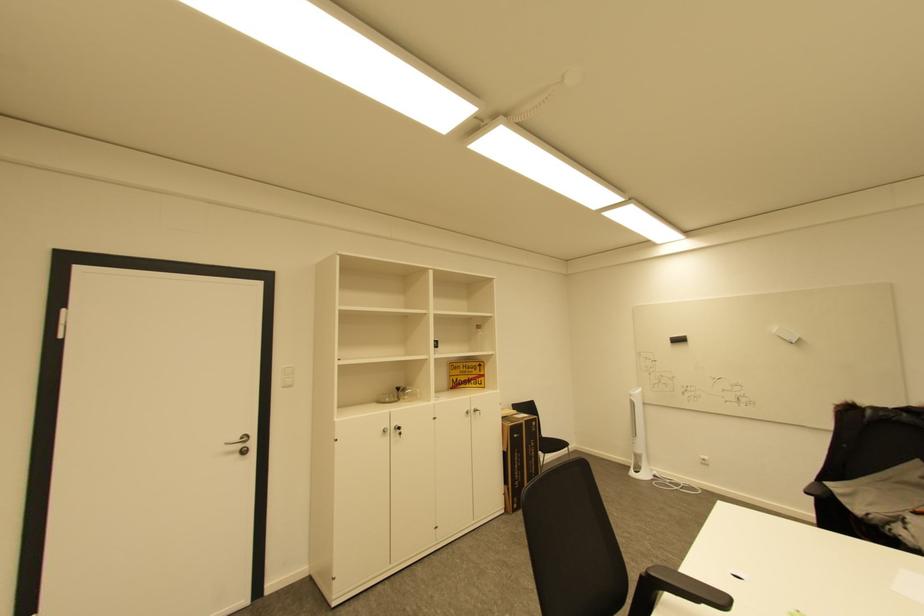
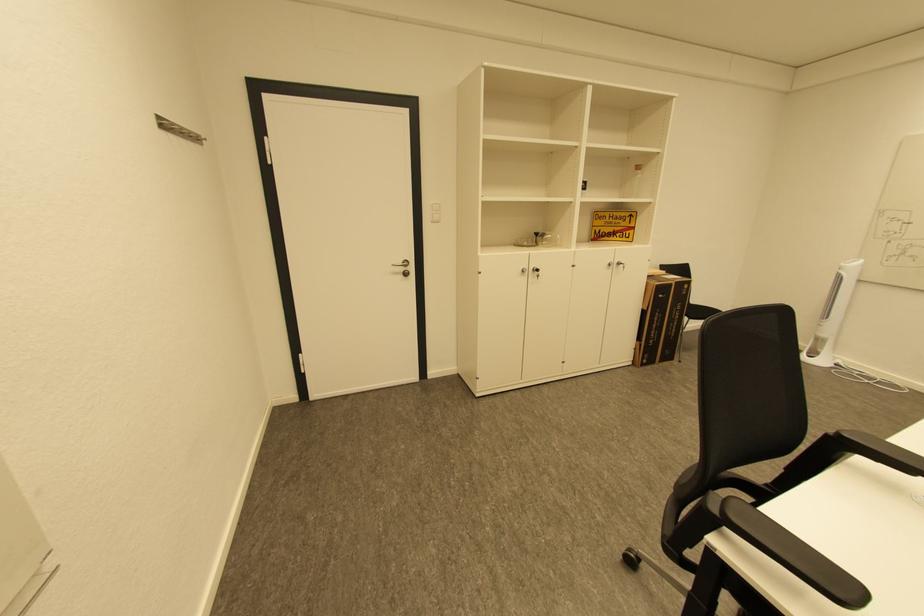
Where in the second image is the point corresponding to the point at 391,432 from the first image?

(529, 272)